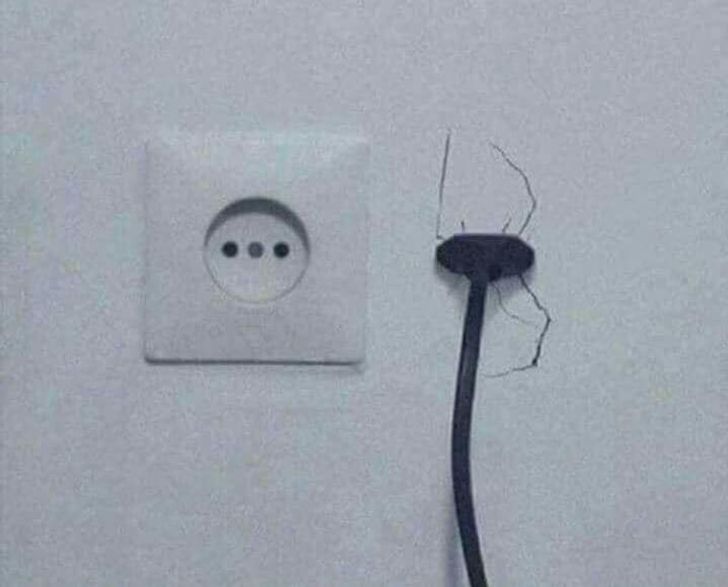
Find the location of a particular element. wall is located at coordinates (263, 462).